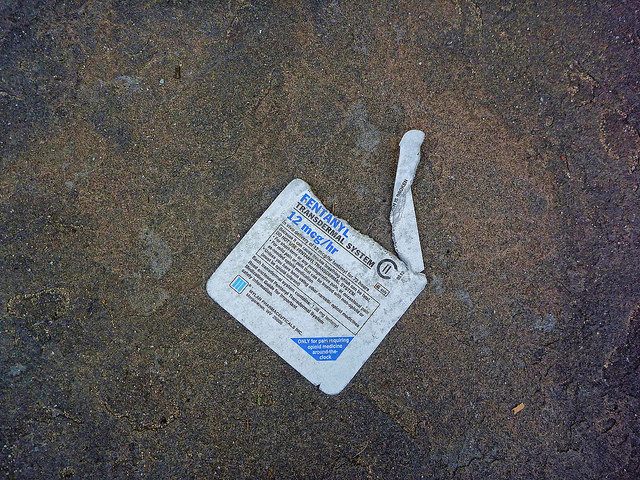
Locate an element on the screen. brown floor is located at coordinates (508, 267).